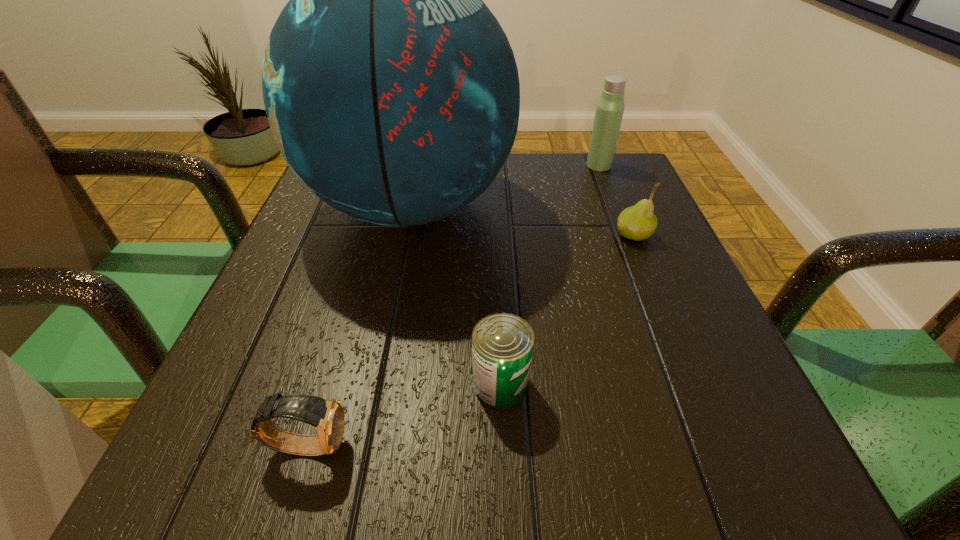
Identify the location of globe present at the far edge. The width and height of the screenshot is (960, 540). (392, 92).

The width and height of the screenshot is (960, 540). In order to click on thermos bottle that is at the far edge in this screenshot , I will do `click(609, 111)`.

Where is `object that is at the near edge`? object that is at the near edge is located at coordinates (327, 416).

The height and width of the screenshot is (540, 960). In order to click on globe present at the left edge in this screenshot , I will do `click(392, 92)`.

I want to click on watch positioned at the left edge, so click(x=327, y=416).

Identify the location of thermos bottle situated at the right edge. (609, 111).

Identify the location of pear that is at the right edge. (638, 222).

This screenshot has width=960, height=540. What are the coordinates of `object that is at the far left corner` in the screenshot? It's located at click(x=392, y=92).

You are a GUI agent. You are given a task and a screenshot of the screen. Output one action in this format:
    pyautogui.click(x=<x>, y=<y>)
    Task: Click on the object that is at the near left corner
    The image size is (960, 540).
    Given the screenshot: What is the action you would take?
    pyautogui.click(x=327, y=416)

I want to click on object that is at the far right corner, so click(x=609, y=111).